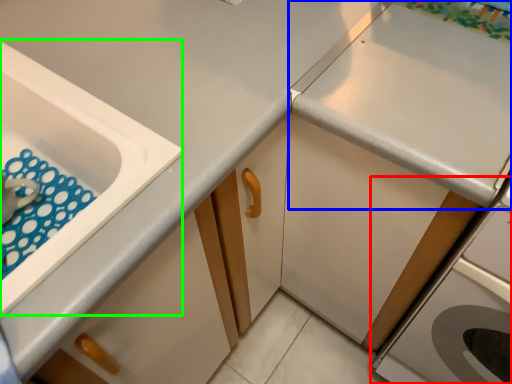
Question: Considering the real-world distances, which object is closest to home appliance (highlighted by a red box)? countertop (highlighted by a blue box) or sink (highlighted by a green box).

Choices:
 (A) countertop
 (B) sink

Answer: (A)